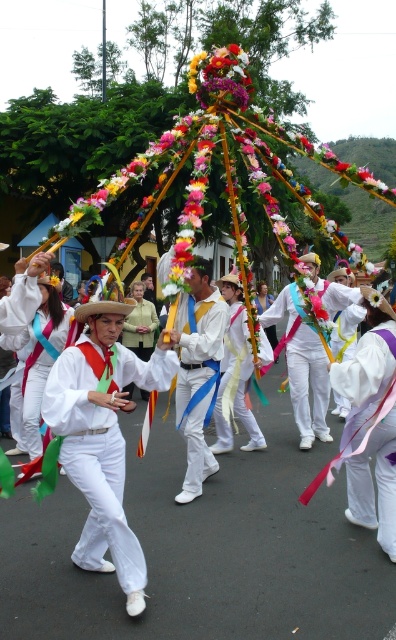
You are a photographer positioned at the front of the procession. You want to take a photo of both the white satin outfit at center and the white satin shirt at center. However, you notice that one of them is blocking the other. Which one should you adjust your angle to focus on first to ensure both are visible?

The white satin outfit at center is in front of the white satin shirt at center, so you should adjust your angle to focus on the white satin shirt at center first to ensure both are visible.

You are a photographer standing near the camera. You want to take a picture of the white satin outfit at center. Is the distance between you and the outfit sufficient to capture a clear, detailed photo with your standard camera lens?

The distance between the white satin outfit at center and the camera is 3.29 meters. A standard camera lens can focus clearly at this distance, so yes, you can capture a clear, detailed photo.